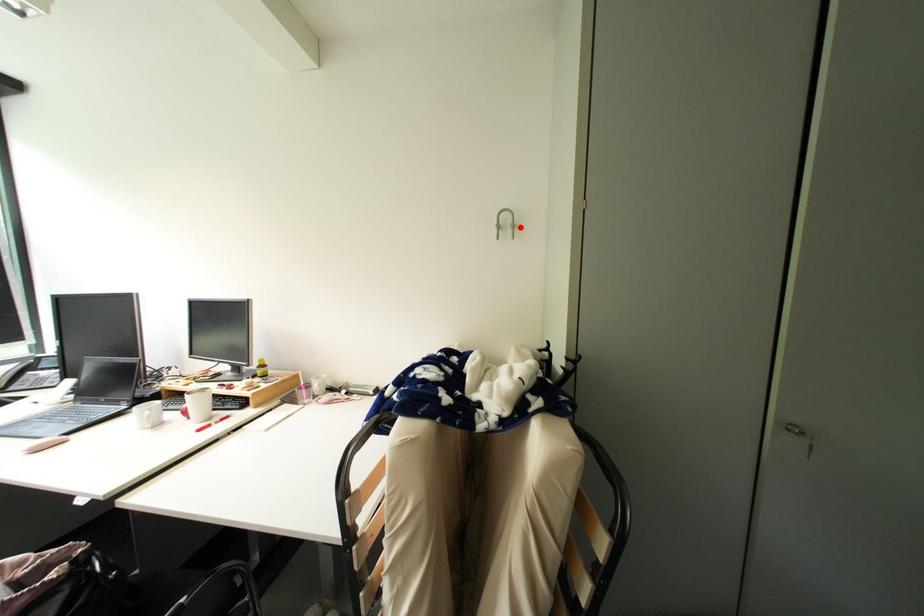
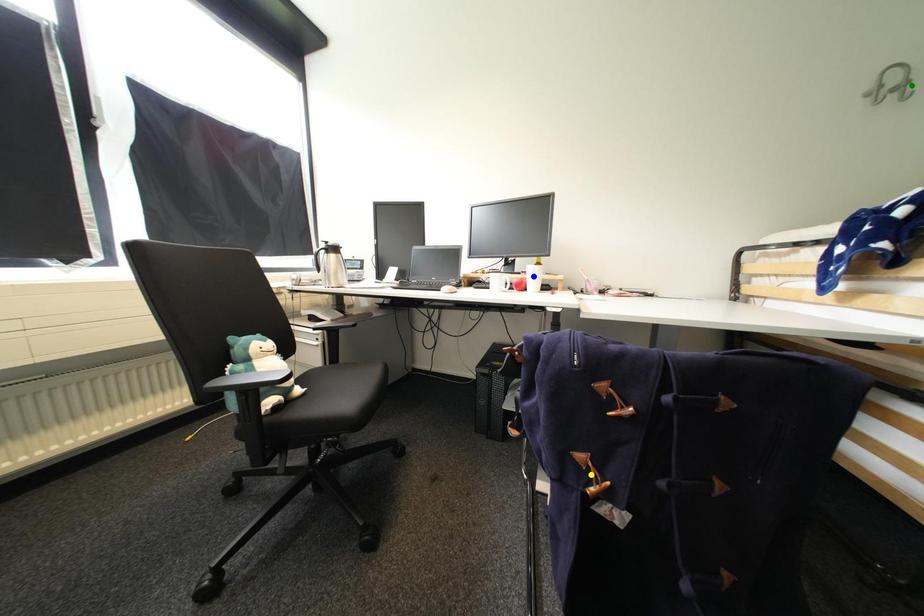
Question: I am providing you with two images of the same scene from different viewpoints. A red point is marked on the first image. You are given multiple points on the second image. Which spot in image 2 lines up with the point in image 1?

Choices:
 (A) green point
 (B) blue point
 (C) yellow point

Answer: (A)